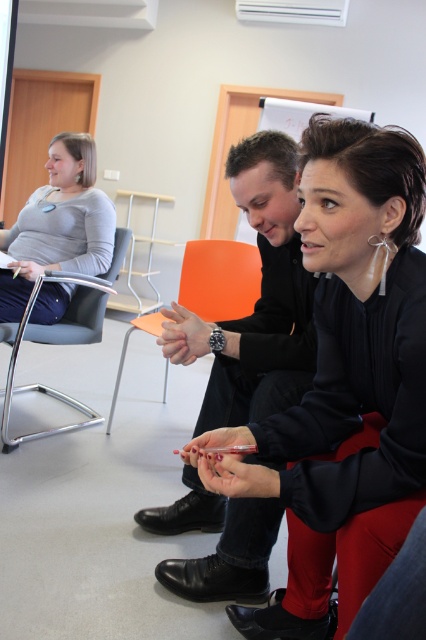
Looking at this image, you are planning to sit in the meeting room and need to choose between the orange plastic chair at center and the metallic gray chair at left. If you prefer a taller chair, which one should you choose?

The metallic gray chair at left is taller than the orange plastic chair at center, so you should choose the metallic gray chair at left if you prefer a taller chair.

From the picture: You are standing in the meeting room and need to locate the matte gray sweater at left. According to the scene description, where would you find it?

Result: The matte gray sweater at left is located at point coordinates (57, 225).

You are a photographer setting up for a group photo in the meeting room. You need to position a small microphone between the matte gray sweater at left and the metallic gray chair at left. Is there enough space to place the microphone between them?

The matte gray sweater at left and metallic gray chair at left are 22.46 centimeters apart from each other. Since the microphone requires minimal space, there is sufficient room to place it between them.